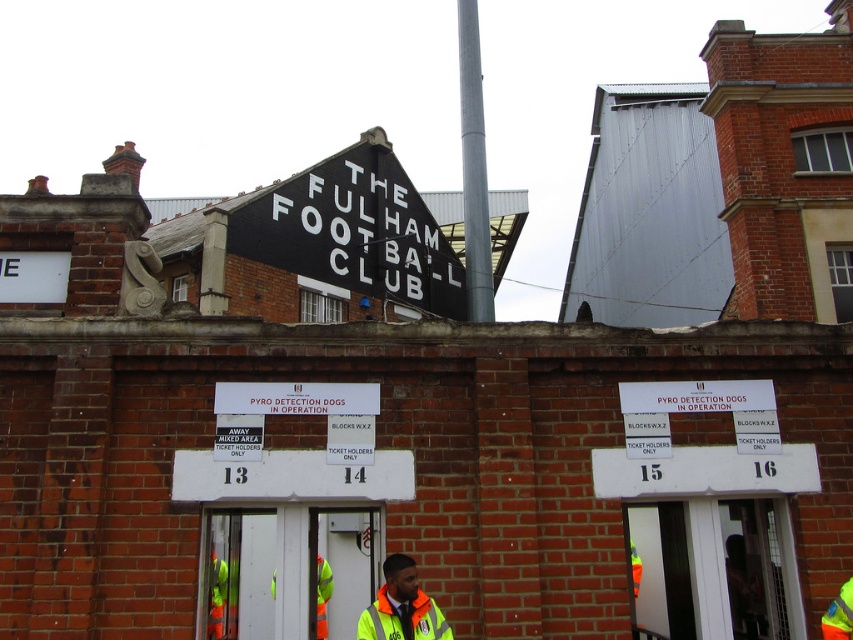
Who is more distant from viewer, (277, 205) or (483, 308)?

The point (277, 205) is behind.

Describe the element at coordinates (352, 230) in the screenshot. I see `black painted signboard at upper center` at that location.

The height and width of the screenshot is (640, 853). I want to click on black painted signboard at upper center, so click(x=352, y=230).

Consider the image. Who is lower down, silver metallic pole at center or high visibility jacket at center?

high visibility jacket at center

Can you confirm if silver metallic pole at center is shorter than high visibility jacket at center?

Incorrect, silver metallic pole at center's height does not fall short of high visibility jacket at center's.

This screenshot has height=640, width=853. Identify the location of silver metallic pole at center. (473, 168).

Identify the location of silver metallic pole at center. (473, 168).

Does black painted signboard at upper center appear on the left side of high visibility jacket at center?

Correct, you'll find black painted signboard at upper center to the left of high visibility jacket at center.

Does point (384, 138) come in front of point (397, 595)?

No.

Where is `black painted signboard at upper center`? The image size is (853, 640). black painted signboard at upper center is located at coordinates (352, 230).